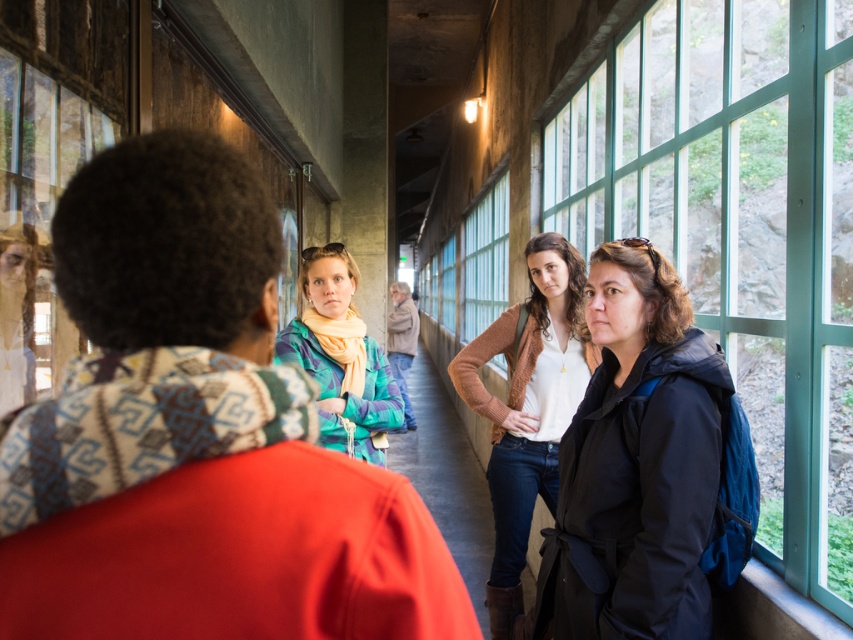
Question: Which point appears closest to the camera in this image?

Choices:
 (A) (796, 141)
 (B) (323, 556)
 (C) (728, 397)

Answer: (B)

Question: Does knitted wool scarf at center lie behind clear glass window at right?

Choices:
 (A) yes
 (B) no

Answer: (B)

Question: Which object appears farthest from the camera in this image?

Choices:
 (A) transparent glass window at upper left
 (B) multicolored scarf at center

Answer: (B)

Question: Can you confirm if matte black jacket at center is positioned to the right of transparent glass window at upper left?

Choices:
 (A) no
 (B) yes

Answer: (B)

Question: Estimate the real-world distances between objects in this image. Which object is closer to the clear glass window at right?

Choices:
 (A) knit sweater at center
 (B) matte black jacket at center
 (C) knitted wool scarf at center
 (D) multicolored scarf at center

Answer: (B)

Question: Is matte black jacket at center further to the viewer compared to transparent glass window at upper left?

Choices:
 (A) no
 (B) yes

Answer: (B)